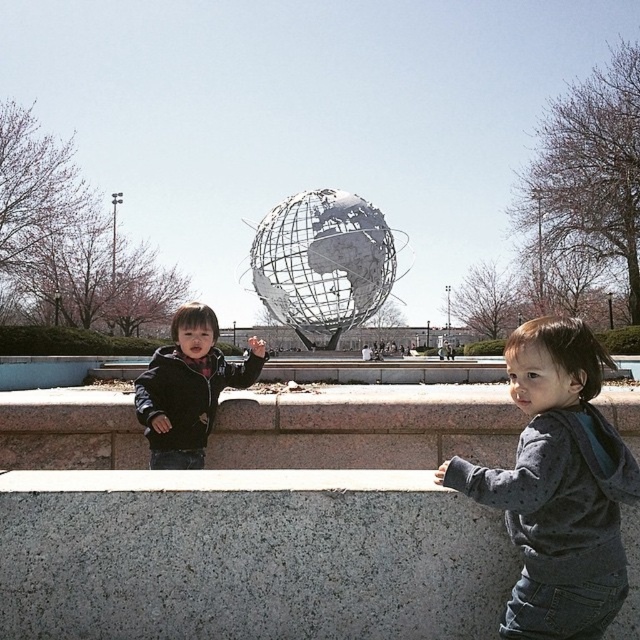
You are standing at the camera position and want to walk directly towards the point at coordinates (362, 264). How far will you have to walk to reach that point?

The point at coordinates (362, 264) is 92.37 meters away from the camera, so you will have to walk 92.37 meters to reach it.

You are trying to locate two specific points in the image. The first point is at coordinates point (592, 572) and the second is at point (321, 253). Which of these points is closer to the viewer?

Point (592, 572) is in front of point (321, 253), so it is closer to the viewer.

Based on the coordinates provided, where is the gray speckled hoodie at lower right located in the image?

The gray speckled hoodie at lower right is located at point (557, 486).